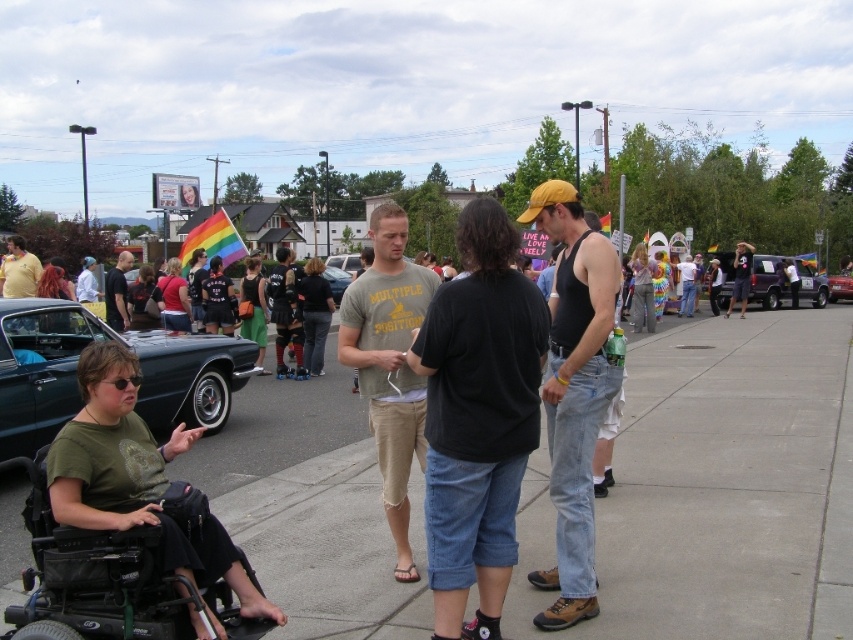
Is black plastic wheelchair at lower left wider than matte black suv at center?

Yes, black plastic wheelchair at lower left is wider than matte black suv at center.

From the picture: Is black plastic wheelchair at lower left below matte black suv at center?

Correct, black plastic wheelchair at lower left is located below matte black suv at center.

What do you see at coordinates (93, 577) in the screenshot?
I see `black plastic wheelchair at lower left` at bounding box center [93, 577].

Find the location of a particular element. The width and height of the screenshot is (853, 640). black plastic wheelchair at lower left is located at coordinates (93, 577).

Can you confirm if matte black suv at center is shorter than matte green shirt at lower left?

Yes.

Image resolution: width=853 pixels, height=640 pixels. Describe the element at coordinates (767, 280) in the screenshot. I see `matte black suv at center` at that location.

You are a GUI agent. You are given a task and a screenshot of the screen. Output one action in this format:
    pyautogui.click(x=<x>, y=<y>)
    Task: Click on the matte black suv at center
    This screenshot has width=853, height=640.
    Given the screenshot: What is the action you would take?
    pyautogui.click(x=767, y=280)

How much distance is there between matte black suv at center and shiny silver car at center?

matte black suv at center is 60.24 feet away from shiny silver car at center.

Between matte black suv at center and shiny silver car at center, which one is positioned higher?

shiny silver car at center

This screenshot has width=853, height=640. What do you see at coordinates (767, 280) in the screenshot?
I see `matte black suv at center` at bounding box center [767, 280].

The width and height of the screenshot is (853, 640). I want to click on matte black suv at center, so click(x=767, y=280).